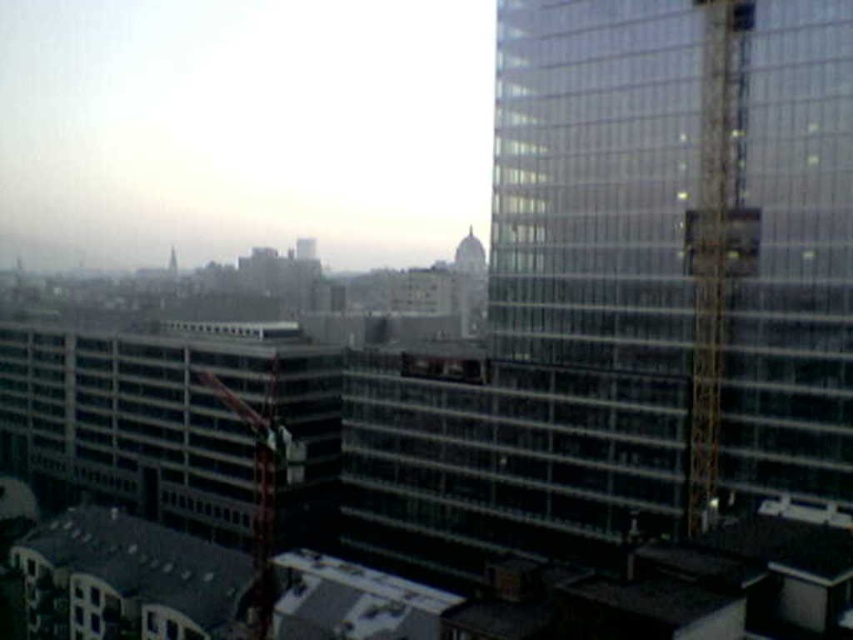
Question: Which point appears closest to the camera in this image?

Choices:
 (A) (270, 595)
 (B) (831, 276)

Answer: (A)

Question: Considering the relative positions of gold/yellow metal crane at right and metallic red crane at center-left in the image provided, where is gold/yellow metal crane at right located with respect to metallic red crane at center-left?

Choices:
 (A) above
 (B) below

Answer: (A)

Question: Does transparent glass tower at right have a smaller size compared to metallic red crane at center-left?

Choices:
 (A) no
 (B) yes

Answer: (B)

Question: Which is farther from the metallic red crane at center-left?

Choices:
 (A) gold/yellow metal crane at right
 (B) transparent glass tower at right

Answer: (A)

Question: Which of the following is the farthest from the observer?

Choices:
 (A) (796, 136)
 (B) (260, 438)
 (C) (709, 193)

Answer: (C)

Question: Can you confirm if transparent glass tower at right is positioned below gold/yellow metal crane at right?

Choices:
 (A) no
 (B) yes

Answer: (A)